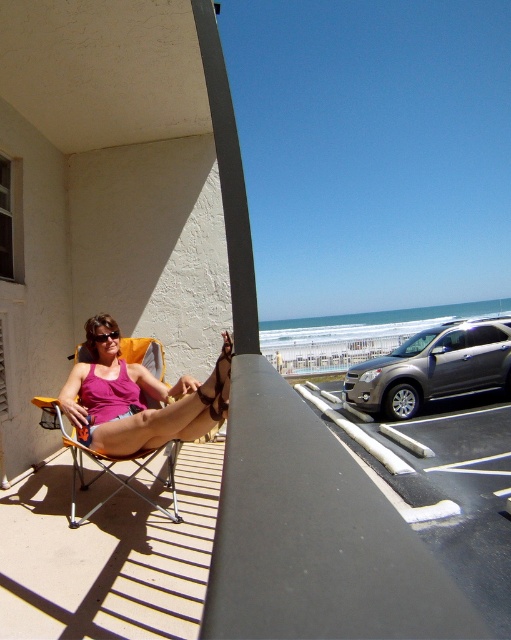
Question: Can you confirm if matte pink tank top at center is positioned below orange fabric chair at center?

Choices:
 (A) yes
 (B) no

Answer: (B)

Question: Can you confirm if matte pink tank top at center is positioned to the left of orange fabric chair at center?

Choices:
 (A) no
 (B) yes

Answer: (A)

Question: Which object appears closest to the camera in this image?

Choices:
 (A) orange fabric chair at center
 (B) matte pink tank top at center

Answer: (B)

Question: Is matte pink tank top at center positioned behind orange fabric chair at center?

Choices:
 (A) yes
 (B) no

Answer: (B)